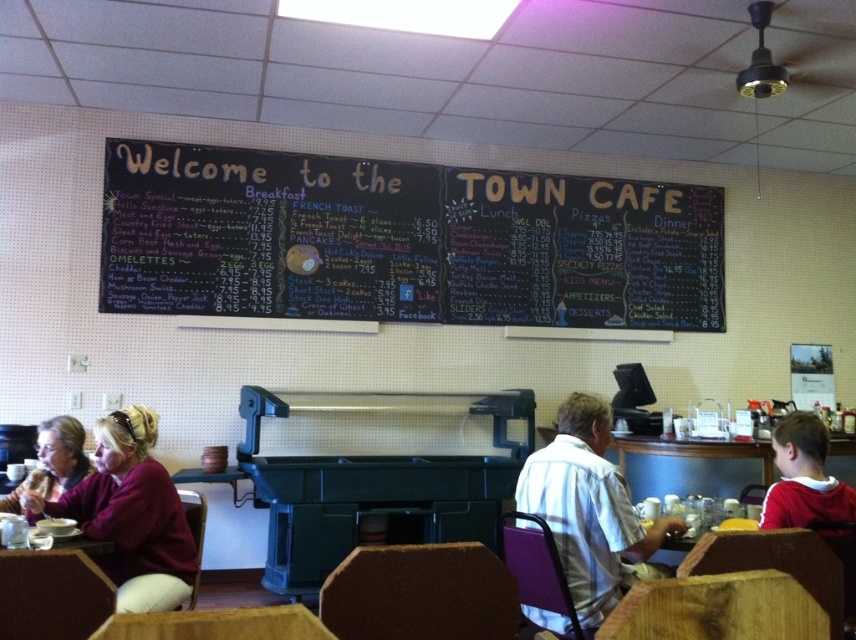
Question: Can you confirm if black chalkboard menu at upper center is wider than maroon sweater at left?

Choices:
 (A) no
 (B) yes

Answer: (B)

Question: Considering the real-world distances, which object is closest to the red fleece jacket at lower right?

Choices:
 (A) black chalkboard menu at upper center
 (B) white striped shirt at center

Answer: (B)

Question: Does maroon sweater at left have a greater width compared to matte brown hair at upper left?

Choices:
 (A) no
 (B) yes

Answer: (B)

Question: Which point is closer to the camera?

Choices:
 (A) red fleece jacket at lower right
 (B) white striped shirt at center
 (C) black chalkboard menu at upper center

Answer: (A)

Question: Considering the real-world distances, which object is farthest from the matte brown hair at upper left?

Choices:
 (A) red fleece jacket at lower right
 (B) black chalkboard menu at upper center
 (C) white striped shirt at center
 (D) maroon sweater at left

Answer: (A)

Question: Is white striped shirt at center wider than matte brown hair at upper left?

Choices:
 (A) yes
 (B) no

Answer: (A)